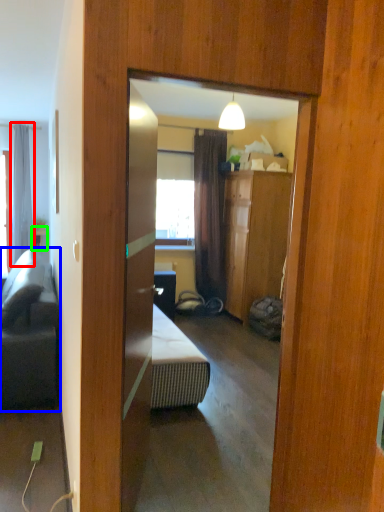
Question: Which object is the farthest from curtain (highlighted by a red box)? Choose among these: studio couch (highlighted by a blue box) or table (highlighted by a green box).

Choices:
 (A) studio couch
 (B) table

Answer: (A)